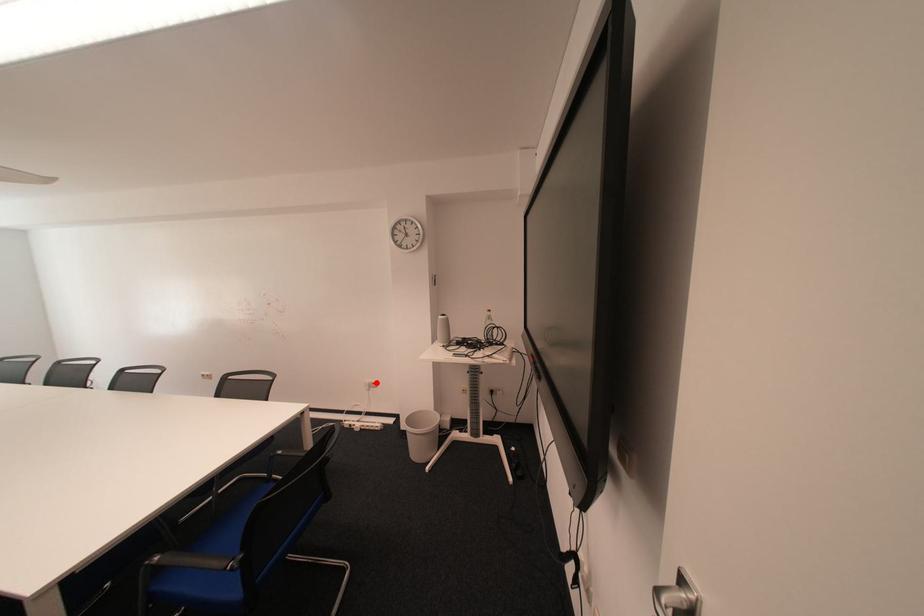
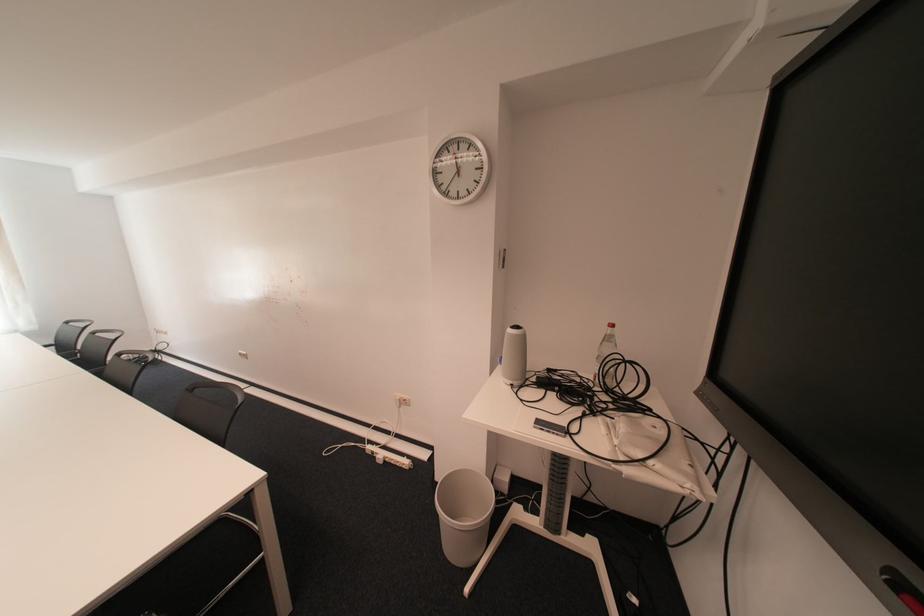
Locate, in the second image, the point that corresponds to the highlighted location in the first image.

(407, 397)